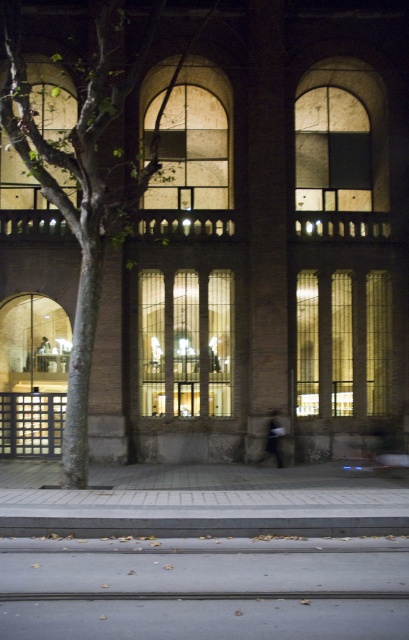
Question: Which point is farther to the camera?

Choices:
 (A) green rough bark tree at left
 (B) gray concrete curb at lower center
 (C) gray concrete pavement at lower center

Answer: (A)

Question: Is gray concrete pavement at lower center closer to camera compared to green rough bark tree at left?

Choices:
 (A) yes
 (B) no

Answer: (A)

Question: Which point is farther from the camera taking this photo?

Choices:
 (A) (155, 564)
 (B) (168, 86)
 (C) (325, 525)

Answer: (B)

Question: Among these points, which one is farthest from the camera?

Choices:
 (A) (227, 618)
 (B) (27, 529)

Answer: (B)

Question: Where is gray concrete pavement at lower center located in relation to gray concrete curb at lower center in the image?

Choices:
 (A) below
 (B) above

Answer: (A)

Question: Can you confirm if green rough bark tree at left is smaller than gray concrete curb at lower center?

Choices:
 (A) yes
 (B) no

Answer: (B)